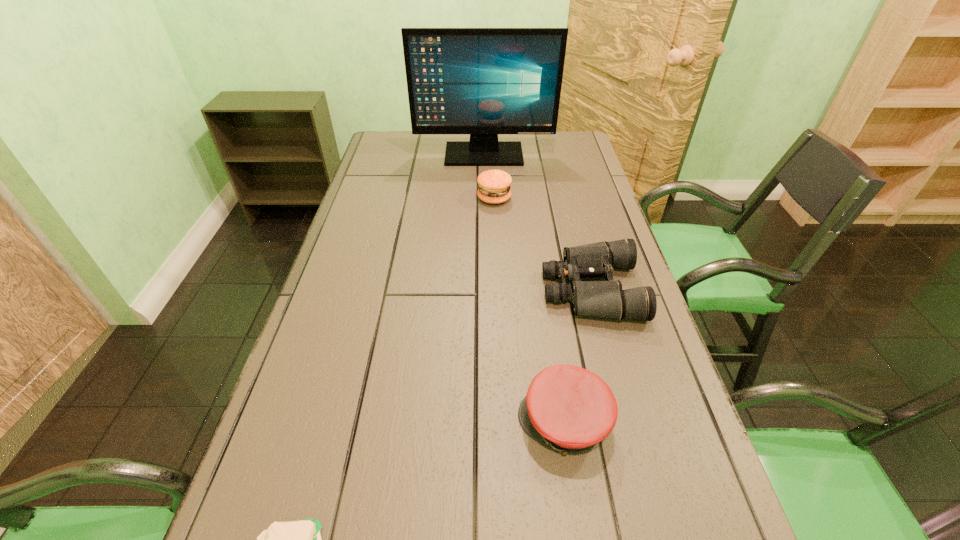
What are the coordinates of `blank space located through the eyepieces of the binoculars` in the screenshot? It's located at (402, 290).

This screenshot has height=540, width=960. I want to click on blank space located 0.110m on the front of the cap with an emblem, so click(x=460, y=423).

The image size is (960, 540). In order to click on vacant region located 0.310m on the front of the cap with an emblem in this screenshot , I will do `click(354, 423)`.

The height and width of the screenshot is (540, 960). I want to click on vacant space located on the front of the cap with an emblem, so click(428, 423).

You are a GUI agent. You are given a task and a screenshot of the screen. Output one action in this format:
    pyautogui.click(x=<x>, y=<y>)
    Task: Click on the object that is at the far edge
    The image size is (960, 540).
    Given the screenshot: What is the action you would take?
    pyautogui.click(x=480, y=81)

Where is `object that is at the left edge`? This screenshot has width=960, height=540. object that is at the left edge is located at coordinates (480, 81).

Identify the location of monitor that is at the right edge. The image size is (960, 540). (480, 81).

Locate an element on the screen. The width and height of the screenshot is (960, 540). binoculars that is at the right edge is located at coordinates (606, 299).

Identify the location of cap that is at the right edge. This screenshot has width=960, height=540. (571, 409).

At what (x,y) coordinates should I click in order to perform the action: click on object that is at the far left corner. Please return your answer as a coordinate pair (x, y). This screenshot has width=960, height=540. Looking at the image, I should click on [x=480, y=81].